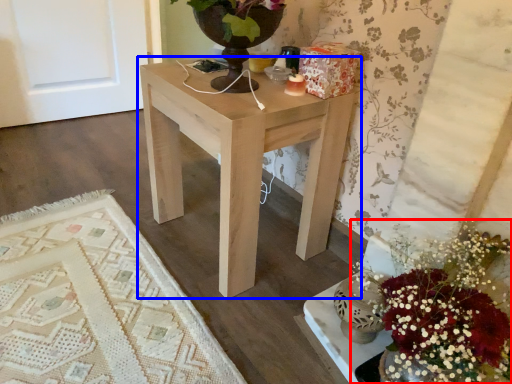
Question: Which of the following is the farthest to the observer, flower (highlighted by a red box) or table (highlighted by a blue box)?

Choices:
 (A) flower
 (B) table

Answer: (B)